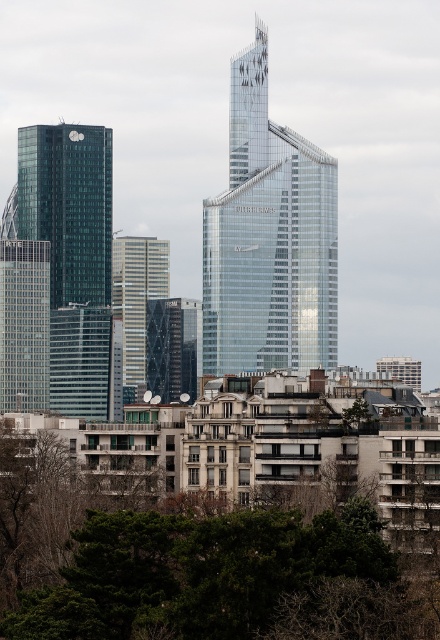
Question: Can you confirm if shiny glass skyscraper at left is positioned to the right of metallic glass tower at center?

Choices:
 (A) yes
 (B) no

Answer: (B)

Question: Which of these objects is positioned closest to the metallic glass tower at center?

Choices:
 (A) transparent glass skyscraper at center
 (B) green leafy tree at center
 (C) shiny glass skyscraper at left

Answer: (C)

Question: Can you confirm if green leafy tree at center is smaller than transparent glass skyscraper at center?

Choices:
 (A) no
 (B) yes

Answer: (A)

Question: Does green leafy tree at center have a larger size compared to metallic glass tower at center?

Choices:
 (A) yes
 (B) no

Answer: (A)

Question: Which object appears farthest from the camera in this image?

Choices:
 (A) metallic glass tower at center
 (B) transparent glass skyscraper at center
 (C) shiny glass skyscraper at left
 (D) green leafy tree at center

Answer: (C)

Question: Which point is farther to the camera?

Choices:
 (A) shiny glass skyscraper at left
 (B) transparent glass skyscraper at center
 (C) green leafy tree at center
 (D) metallic glass tower at center

Answer: (A)